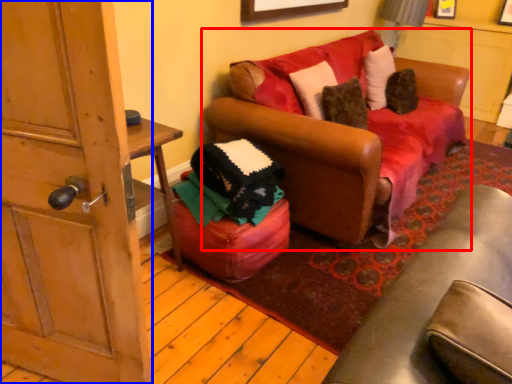
Question: Which point is further to the camera, studio couch (highlighted by a red box) or door (highlighted by a blue box)?

Choices:
 (A) studio couch
 (B) door

Answer: (A)